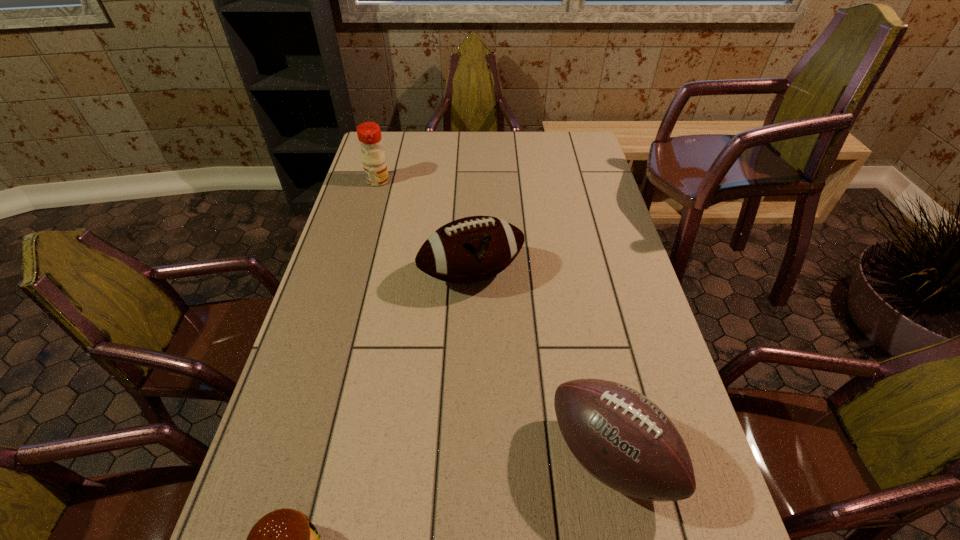
Locate an element on the screen. condiment is located at coordinates (369, 134).

Where is `the left football (American)`? Image resolution: width=960 pixels, height=540 pixels. the left football (American) is located at coordinates (472, 249).

Where is `the second object from right to left`? The width and height of the screenshot is (960, 540). the second object from right to left is located at coordinates (472, 249).

You are a GUI agent. You are given a task and a screenshot of the screen. Output one action in this format:
    pyautogui.click(x=<x>, y=<y>)
    Task: Click on the nearer football (American)
    Image resolution: width=960 pixels, height=540 pixels.
    Given the screenshot: What is the action you would take?
    pyautogui.click(x=624, y=440)

Identify the location of the third farthest object. (624, 440).

Locate an element on the screen. The height and width of the screenshot is (540, 960). vacant space located 0.310m on the back of the condiment is located at coordinates (391, 134).

Locate an element on the screen. This screenshot has height=540, width=960. vacant region located 0.050m on the left of the second farthest object is located at coordinates (403, 274).

Locate an element on the screen. Image resolution: width=960 pixels, height=540 pixels. free space located on the left of the right football (American) is located at coordinates pos(400,456).

Where is `object at the left edge`? object at the left edge is located at coordinates (369, 134).

What are the coordinates of `object located at the right edge` in the screenshot? It's located at (624, 440).